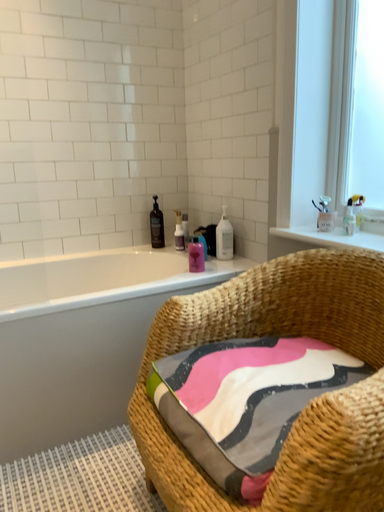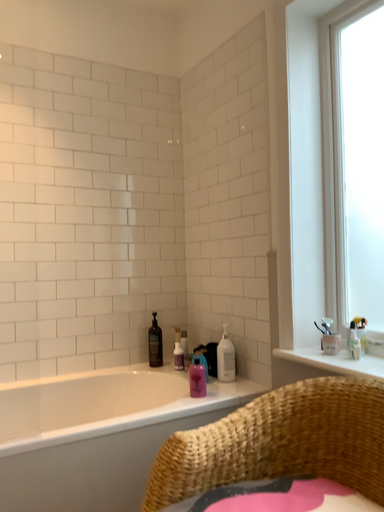
Question: Which way did the camera rotate in the video?

Choices:
 (A) rotated upward
 (B) rotated downward

Answer: (A)